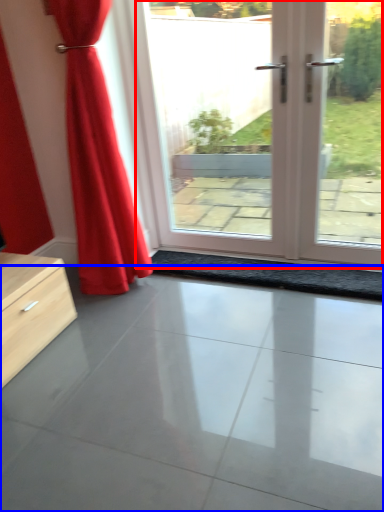
Question: Among these objects, which one is farthest to the camera, door (highlighted by a red box) or concrete (highlighted by a blue box)?

Choices:
 (A) door
 (B) concrete

Answer: (A)